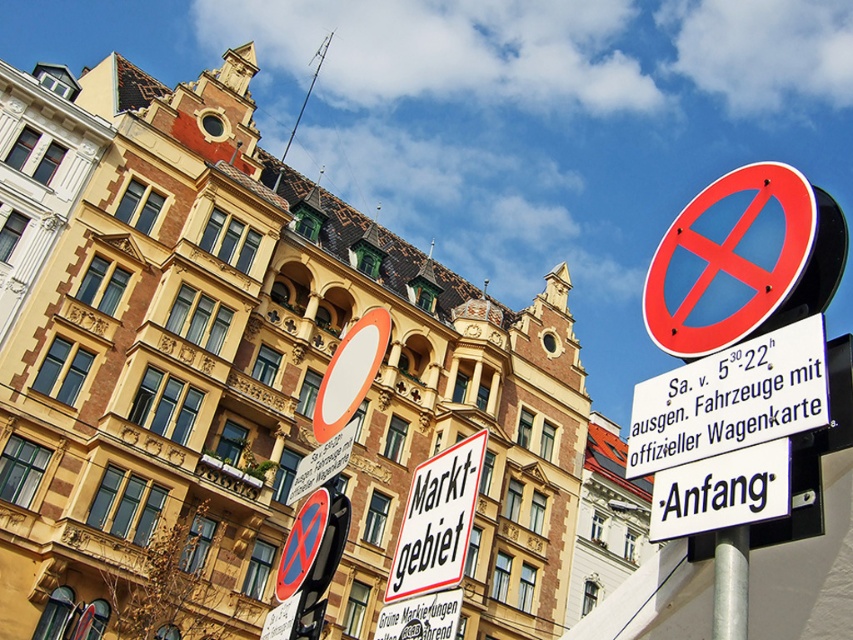
You are a pedestrian standing in front of the historic building and notice the white paper sign at center and the silver metallic pole at lower right. Which object is taller?

The white paper sign at center is taller than the silver metallic pole at lower right.

You are a pedestrian standing in front of the historic building and see the white paper sign at center and the silver metallic pole at lower right. Which object is closer to you?

The white paper sign at center is closer to you because it is further to the viewer than the silver metallic pole at lower right.

You are a city planner assessing the placement of signs near the historic building. The white paper sign at center and the silver metallic pole at lower right are both part of the new signage installation. Based on their widths, which sign might require more space horizontally for proper placement?

The white paper sign at center might require more space horizontally for proper placement since it might be wider than the silver metallic pole at lower right according to the description.